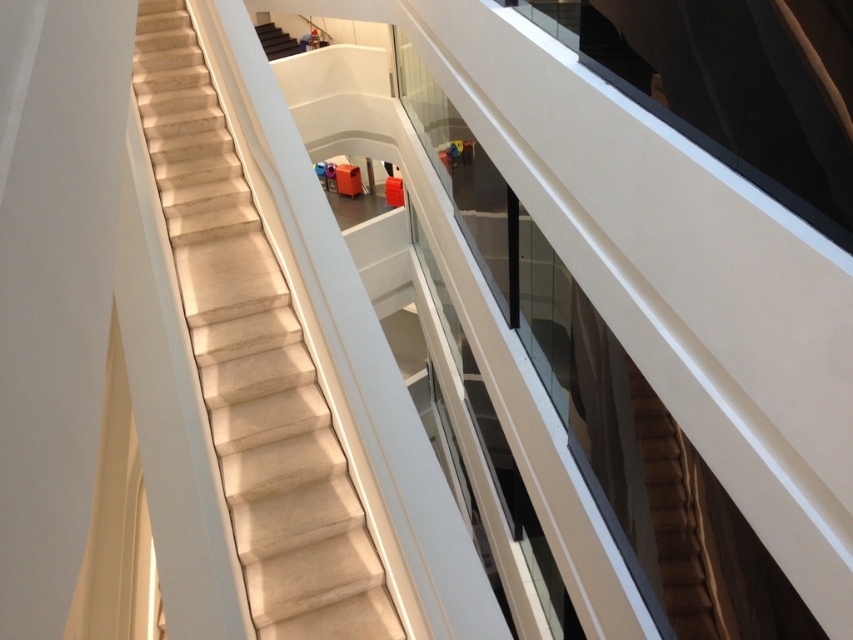
You are standing at the entrance of the building and want to reach the second floor. The white marble stairs at center are the only staircase available. Based on their position, can you estimate whether they are located closer to the entrance or the exit of the building?

The white marble stairs at center are positioned at point (253, 364), which suggests they are centrally located in the space. Since they ascend from the bottom left corner towards the upper right, their starting point is near the entrance area. Therefore, the white marble stairs at center are closer to the entrance than the exit.

You are standing at the bottom of the staircase in the image and want to reach the point labeled as point [253,364]. Is this point located on the staircase or on the floor below?

The point [253,364] is on white marble stairs at center, so it is located on the staircase.